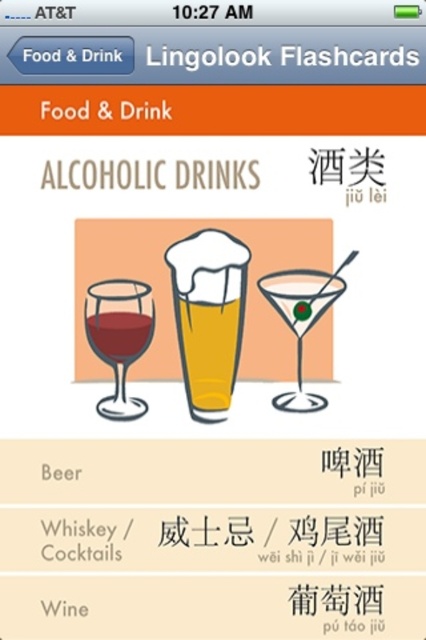
You are using the Lingolook Flashcards app to study Chinese vocabulary. The app shows you an image with a transparent glass martini at center. Where exactly is the transparent glass martini located on the screen? Please provide its coordinates as a point between 0 and 1 in both x and y directions.

The transparent glass martini at center is located at coordinates point (x=302, y=320).

In the scene shown: You are using the Lingolook Flashcards app and want to compare the sizes of the two glasses shown in the Alcoholic Drinks section. Which of the two glasses, the transparent glass martini at center or the matte glass at center, has a larger width?

The transparent glass martini at center has a larger width than the matte glass at center according to the description.

You are using the Lingolook Flashcards app to study Chinese vocabulary. The current screen shows two objects related to alcoholic drinks. Which object is wider, the matte glass wine at left or the translucent glass at center?

The matte glass wine at left might be wider than the translucent glass at center according to the description.